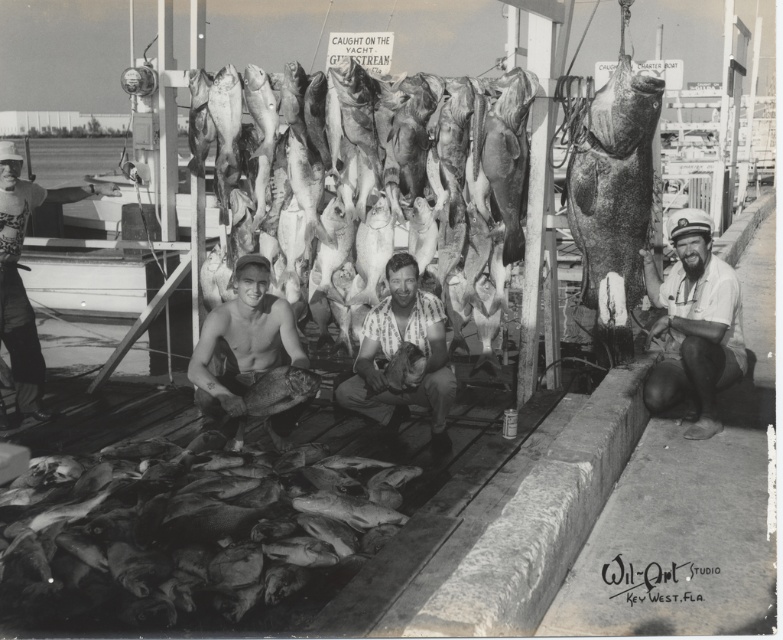
You are a photographer standing at the camera position. You want to take a closeup photo of the point at coordinates point (27,525) and point (706,273). Which point is easier to capture in your current position?

Point (27,525) is closer to the camera than point (706,273), so it will be easier to capture in a closeup photo from the current position.

You are a photographer standing at the dockside and want to take a picture of the shiny silver fish at right and the white cotton shirt at lower right. Which object will appear larger in your photo?

The shiny silver fish at right will appear larger in the photo because it is taller than the white cotton shirt at lower right.

You are a photographer who wants to capture a closeup of the smooth skin fish at lower left and the shiny silver helmet at left. Based on their positions, which object should you focus on first if you start from the bottom of the image and move upwards?

The smooth skin fish at lower left should be focused on first because it is located below the shiny silver helmet at left, so it is lower in the image.